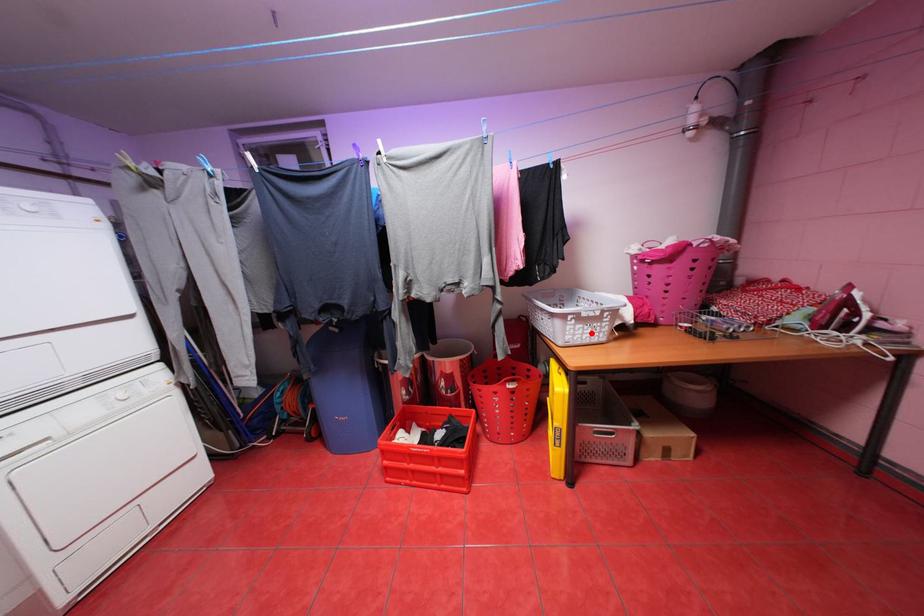
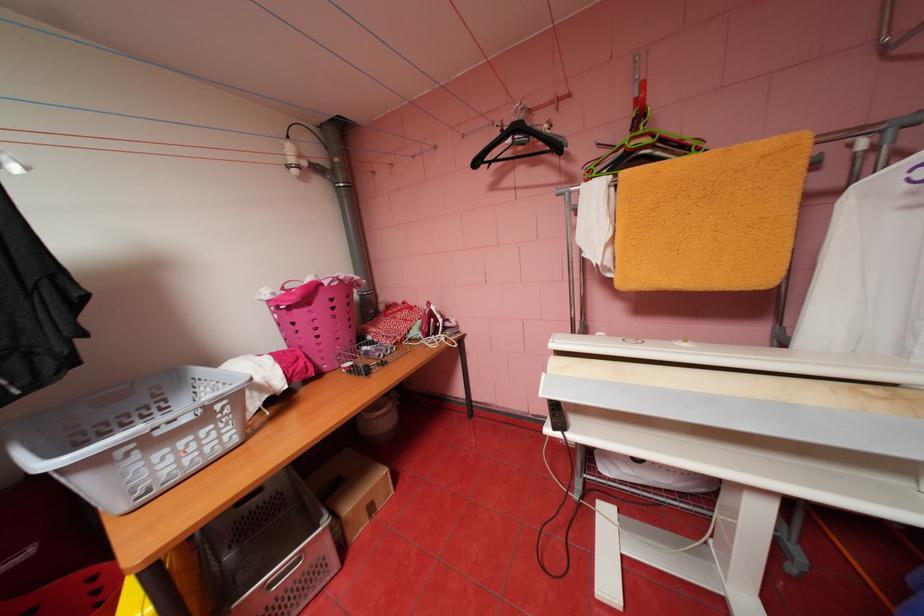
Where in the second image is the point corresponding to the highlighted location from the first image?

(187, 460)